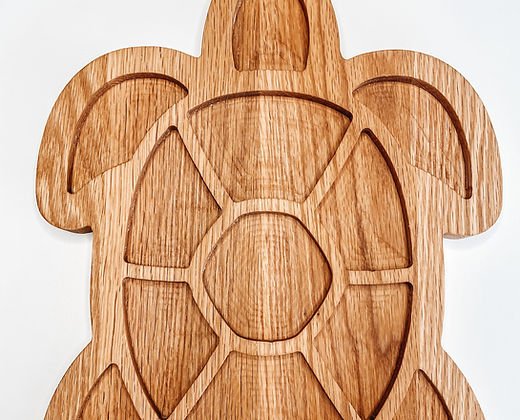
Locate an element on the screen. The image size is (520, 420). edges of tray is located at coordinates (40, 203), (65, 391), (452, 388), (431, 277), (478, 111), (333, 35), (216, 24), (102, 265).